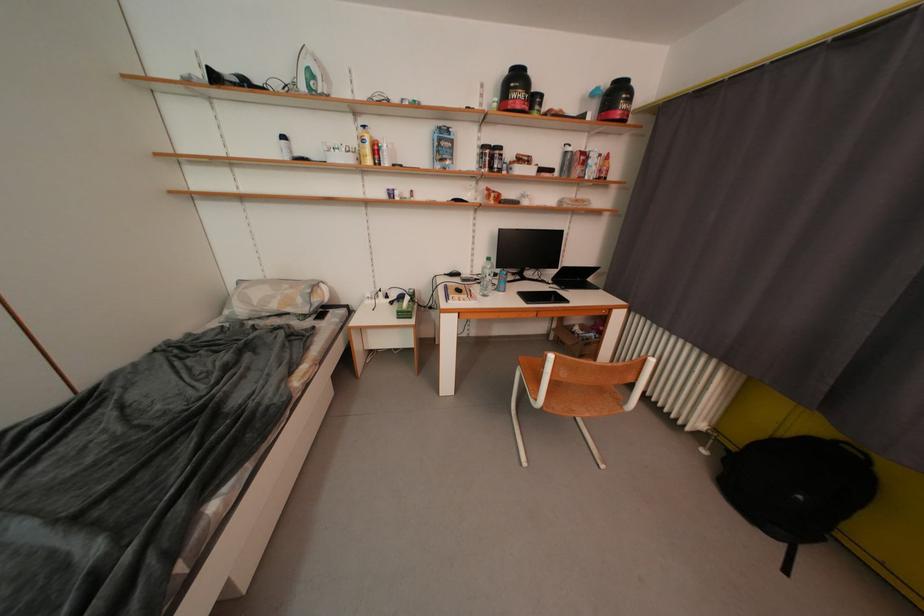
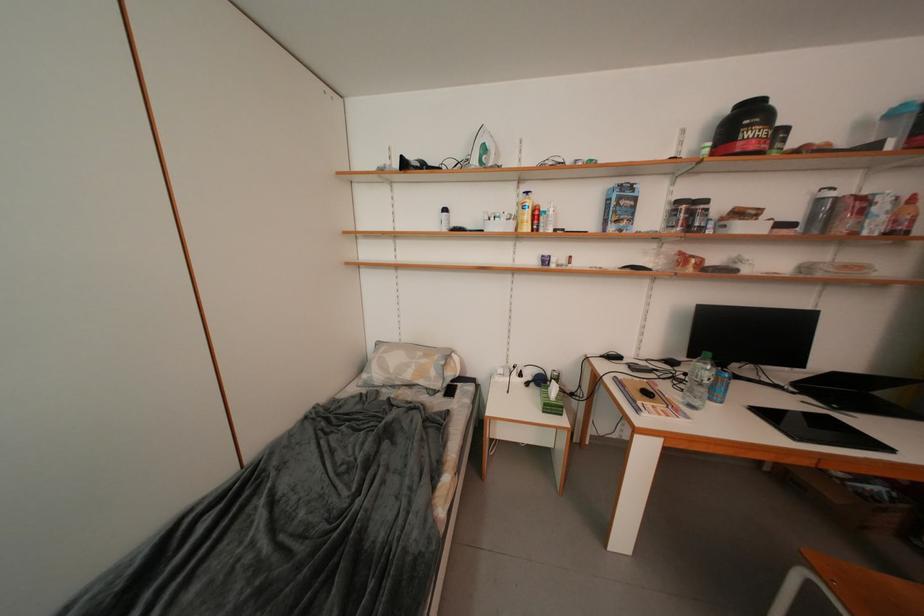
Question: The images are taken continuously from a first-person perspective. In which direction is your viewpoint rotating?

Choices:
 (A) Left
 (B) Right
 (C) Up
 (D) Down

Answer: (A)